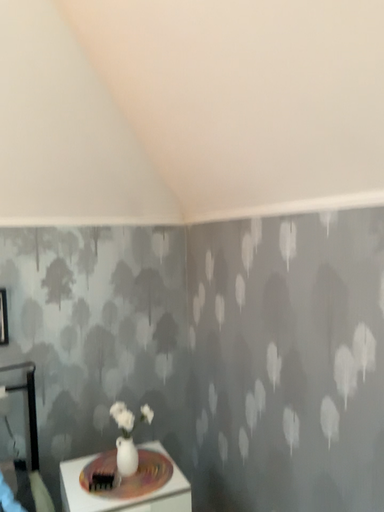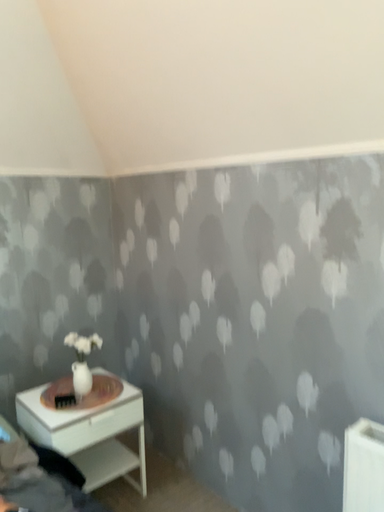
Question: How did the camera likely rotate when shooting the video?

Choices:
 (A) rotated left
 (B) rotated right

Answer: (B)